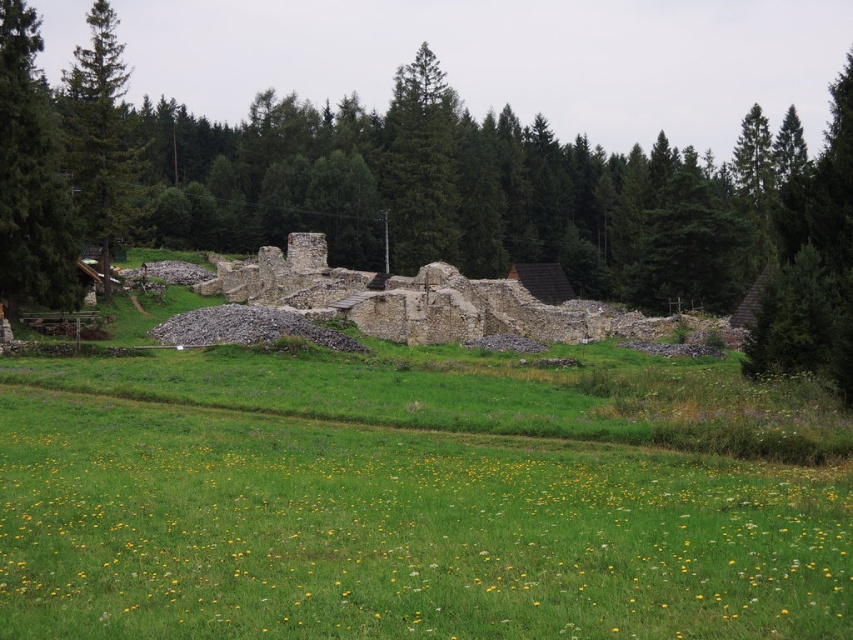
Which is more to the right, green leafy forest at center or green coniferous tree at left?

Positioned to the right is green leafy forest at center.

Is point (532, 157) positioned behind point (131, 209)?

That is True.

Identify the location of green leafy forest at center. This screenshot has height=640, width=853. (527, 202).

The height and width of the screenshot is (640, 853). Find the location of `green leafy forest at center`. green leafy forest at center is located at coordinates (527, 202).

Which of these two, green leafy forest at center or green textured tree at left, stands taller?

Standing taller between the two is green leafy forest at center.

Does green leafy forest at center appear on the left side of green textured tree at left?

Incorrect, green leafy forest at center is not on the left side of green textured tree at left.

The image size is (853, 640). Identify the location of green leafy forest at center. (527, 202).

Who is lower down, green textured tree at center or green coniferous tree at left?

Positioned lower is green textured tree at center.

Between green textured tree at center and green coniferous tree at left, which one has less height?

green textured tree at center is shorter.

Locate an element on the screen. This screenshot has height=640, width=853. green textured tree at center is located at coordinates (419, 164).

Image resolution: width=853 pixels, height=640 pixels. In order to click on green textured tree at center in this screenshot , I will do `click(419, 164)`.